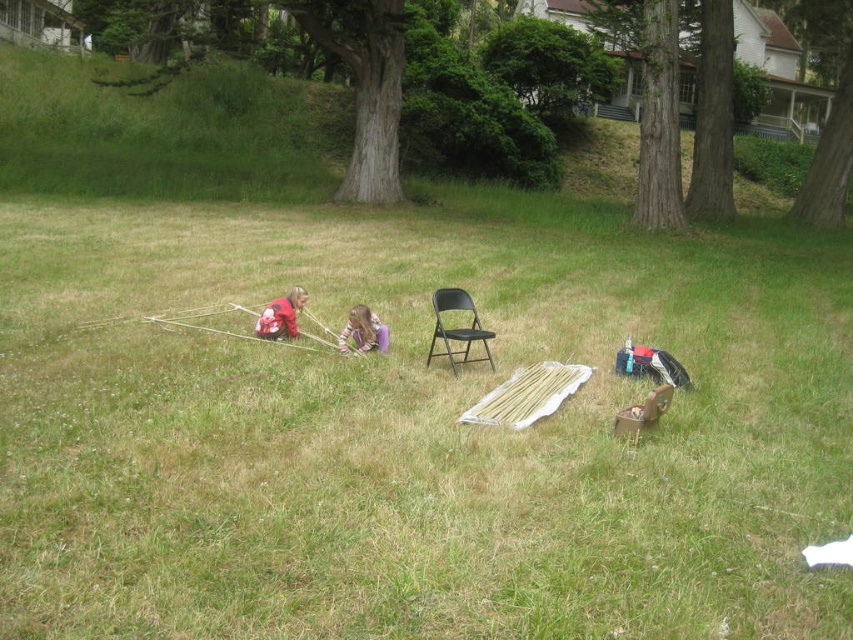
You are a photographer planning to capture a wide shot of the scene. Since the red matte jacket at center and the purple fabric at center are both in the frame, which object takes up more area in the photo?

The purple fabric at center takes up more area in the photo because it occupies more space than the red matte jacket at center.